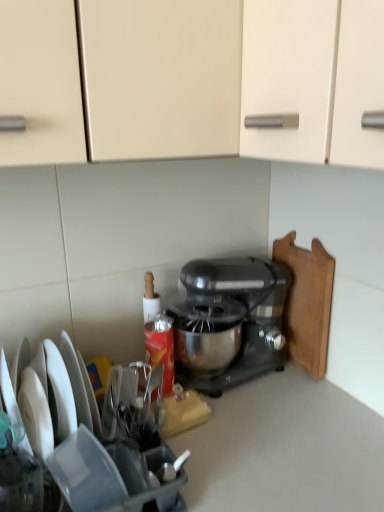
At what (x,y) coordinates should I click in order to perform the action: click on wooden cutting board at right. Please return your answer as a coordinate pair (x, y). The image size is (384, 512). Looking at the image, I should click on (307, 302).

Image resolution: width=384 pixels, height=512 pixels. In order to click on metallic silver mixer at center in this screenshot , I will do `click(228, 320)`.

In the image, is metallic silver mixer at center positioned in front of or behind wooden cutting board at right?

Visually, metallic silver mixer at center is located in front of wooden cutting board at right.

From the image's perspective, is metallic silver mixer at center under wooden cutting board at right?

Yes, from the image's perspective, metallic silver mixer at center is beneath wooden cutting board at right.

Visually, is metallic silver mixer at center positioned to the left or to the right of wooden cutting board at right?

In the image, metallic silver mixer at center appears on the left side of wooden cutting board at right.

Does satin black mixer at center have a greater height compared to metallic silver mixer at center?

No, satin black mixer at center is not taller than metallic silver mixer at center.

Locate an element on the screen. The width and height of the screenshot is (384, 512). appliance located below the metallic silver mixer at center (from the image's perspective) is located at coordinates (82, 440).

Which object is positioned more to the right, satin black mixer at center or metallic silver mixer at center?

metallic silver mixer at center is more to the right.

From the picture: Is satin black mixer at center wider or thinner than metallic silver mixer at center?

Clearly, satin black mixer at center has more width compared to metallic silver mixer at center.

Considering the relative sizes of wooden cutting board at right and satin black mixer at center in the image provided, is wooden cutting board at right wider than satin black mixer at center?

No.

Looking at this image, from the image's perspective, which one is positioned higher, wooden cutting board at right or satin black mixer at center?

wooden cutting board at right appears higher in the image.

Who is smaller, wooden cutting board at right or satin black mixer at center?

wooden cutting board at right is smaller.

Is wooden cutting board at right in front of or behind satin black mixer at center in the image?

wooden cutting board at right is behind satin black mixer at center.

Find the location of a particular element. This screenshot has height=512, width=384. cutting board positioned vertically above the metallic silver mixer at center (from a real-world perspective) is located at coordinates (307, 302).

In the scene shown: Is wooden cutting board at right facing towards metallic silver mixer at center?

Yes, wooden cutting board at right is oriented towards metallic silver mixer at center.

Measure the distance between wooden cutting board at right and metallic silver mixer at center.

wooden cutting board at right is 6.56 inches away from metallic silver mixer at center.

From a real-world perspective, who is located lower, wooden cutting board at right or metallic silver mixer at center?

From a 3D spatial view, metallic silver mixer at center is below.

Can you see satin black mixer at center touching wooden cutting board at right?

satin black mixer at center is not next to wooden cutting board at right, and they're not touching.

Considering the sizes of objects satin black mixer at center and wooden cutting board at right in the image provided, who is smaller, satin black mixer at center or wooden cutting board at right?

With smaller size is wooden cutting board at right.

In the scene shown: Which of these two, satin black mixer at center or wooden cutting board at right, stands taller?

Standing taller between the two is wooden cutting board at right.

Can you tell me how much metallic silver mixer at center and satin black mixer at center differ in facing direction?

The angular difference between metallic silver mixer at center and satin black mixer at center is 92.9 degrees.

Does metallic silver mixer at center turn towards satin black mixer at center?

Yes.

From the image's perspective, is metallic silver mixer at center on top of satin black mixer at center?

Indeed, from the image's perspective, metallic silver mixer at center is shown above satin black mixer at center.

Locate an element on the screen. mixer in front of the wooden cutting board at right is located at coordinates (228, 320).

The height and width of the screenshot is (512, 384). Identify the location of mixer on the right of satin black mixer at center. (228, 320).

Looking at the image, which one is located closer to satin black mixer at center, wooden cutting board at right or metallic silver mixer at center?

metallic silver mixer at center.

Looking at this image, from the image, which object appears to be farther from metallic silver mixer at center, wooden cutting board at right or satin black mixer at center?

satin black mixer at center is positioned further to the anchor metallic silver mixer at center.

Based on their spatial positions, is metallic silver mixer at center or satin black mixer at center further from wooden cutting board at right?

satin black mixer at center is further to wooden cutting board at right.

Looking at the image, which one is located further to metallic silver mixer at center, satin black mixer at center or wooden cutting board at right?

The object further to metallic silver mixer at center is satin black mixer at center.

From the image, which object appears to be nearer to wooden cutting board at right, satin black mixer at center or metallic silver mixer at center?

metallic silver mixer at center lies closer to wooden cutting board at right than the other object.

Estimate the real-world distances between objects in this image. Which object is further from satin black mixer at center, metallic silver mixer at center or wooden cutting board at right?

The object further to satin black mixer at center is wooden cutting board at right.

You are a GUI agent. You are given a task and a screenshot of the screen. Output one action in this format:
    pyautogui.click(x=<x>, y=<y>)
    Task: Click on the mixer situated between satin black mixer at center and wooden cutting board at right from left to right
    The height and width of the screenshot is (512, 384).
    Given the screenshot: What is the action you would take?
    pyautogui.click(x=228, y=320)